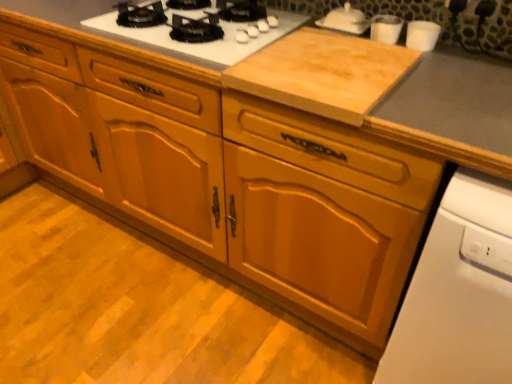
Find the location of a particular element. free spot in front of white glossy cups at upper right, the first appliance in the right-to-left sequence is located at coordinates (429, 65).